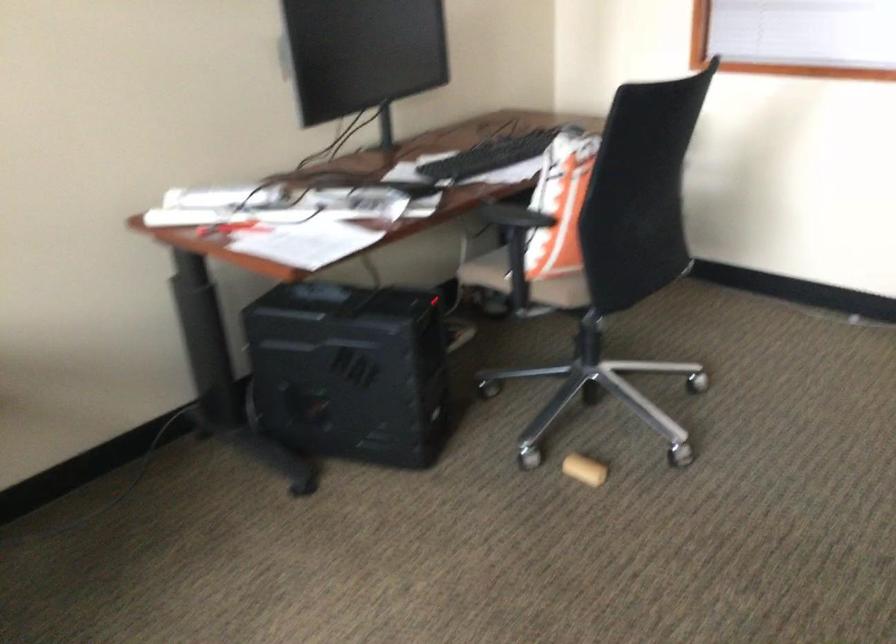
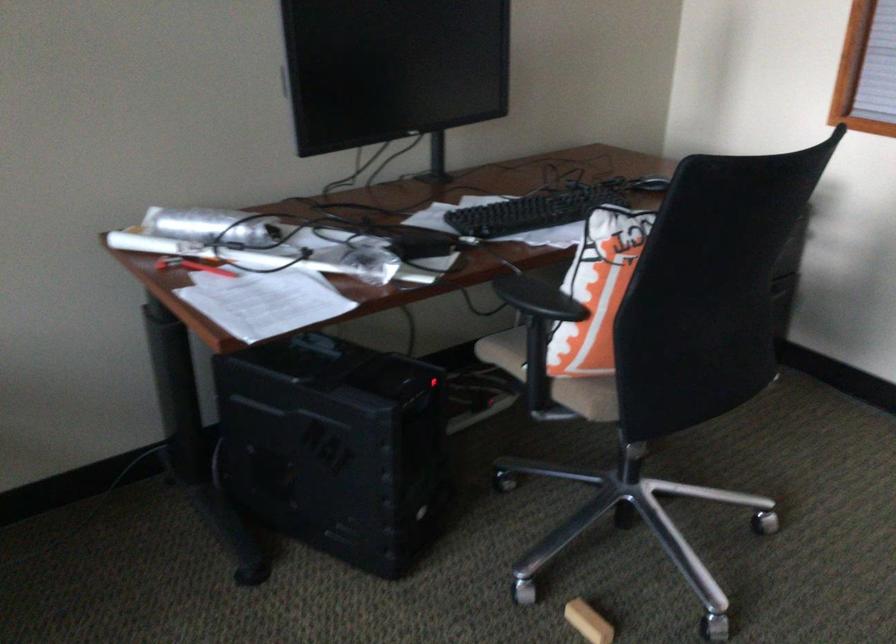
The point at (564, 200) is marked in the first image. Where is the corresponding point in the second image?

(597, 290)